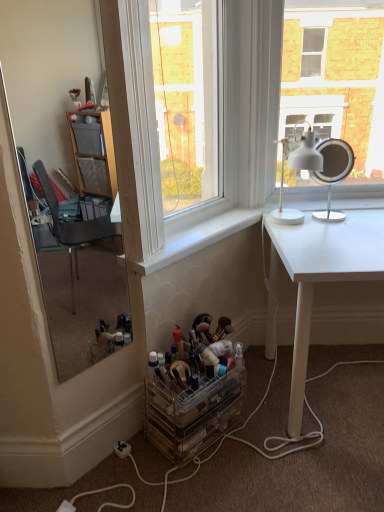
This screenshot has width=384, height=512. In order to click on free spot in front of white plastic table lamp at upper right, which is counted as the first table lamp, starting from the right in this screenshot , I will do `click(340, 231)`.